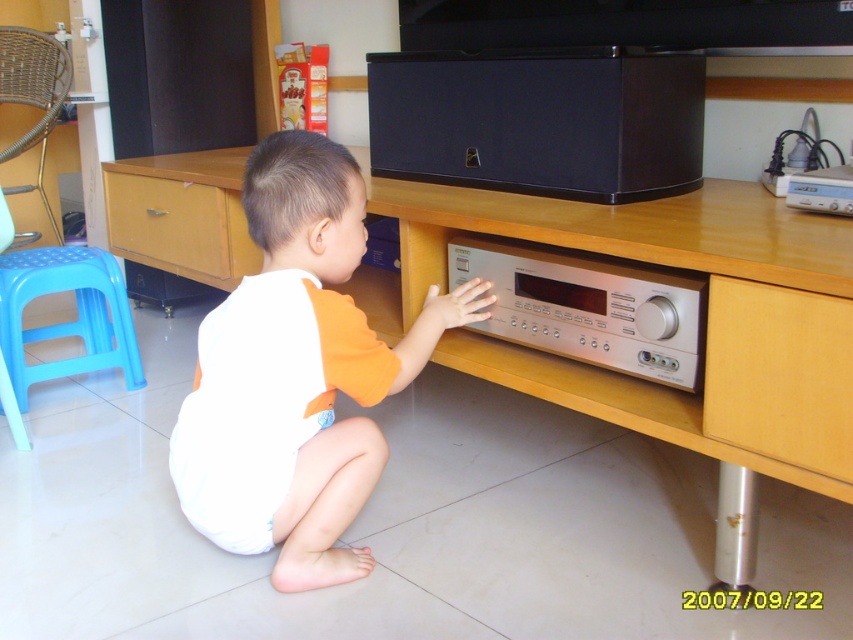
You are a parent trying to reach the wooden drawer at lower right to get a toy for your child. Can you step on the blue plastic stool at left to reach it?

The wooden drawer at lower right is not as tall as the blue plastic stool at left, so stepping on the blue plastic stool at left would allow you to reach the wooden drawer at lower right.

Looking at this image, you are a parent trying to place a small toy on a surface that is higher than the wooden drawer at lower left but lower than the blue plastic stool at left. Is there a suitable surface available in the scene?

The blue plastic stool at left has a greater height compared to the wooden drawer at lower left, so there is no surface available in the scene that is higher than the wooden drawer at lower left but lower than the blue plastic stool at left.

You are a parent entering the room and want to place a small toy between the white cotton toddler at center and the blue plastic stool at left. Considering their sizes, which object should the toy be closer to?

The white cotton toddler at center is larger than the blue plastic stool at left, so the toy should be placed closer to the smaller blue plastic stool at left to maintain balance.